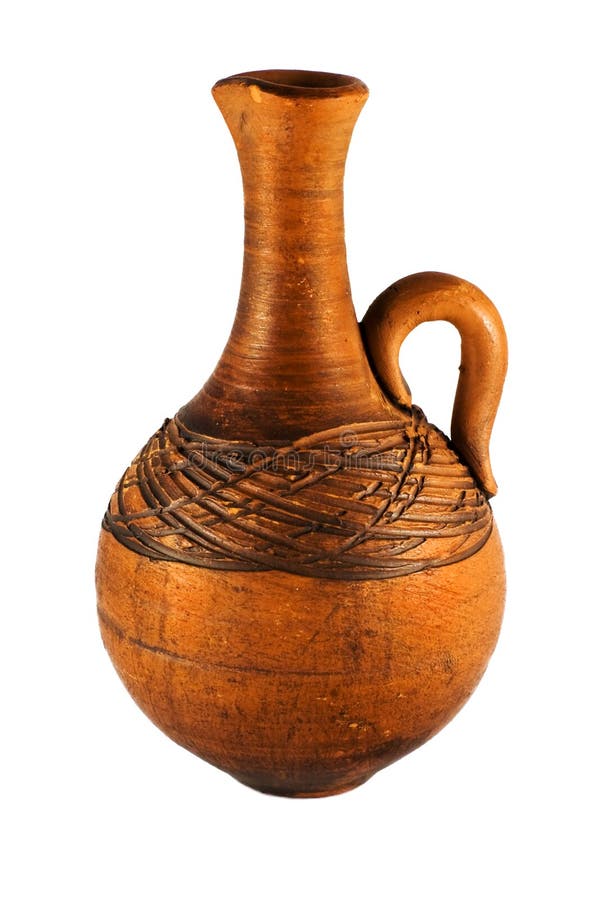
Identify the location of black coloring on carafe. (268, 418), (206, 417).